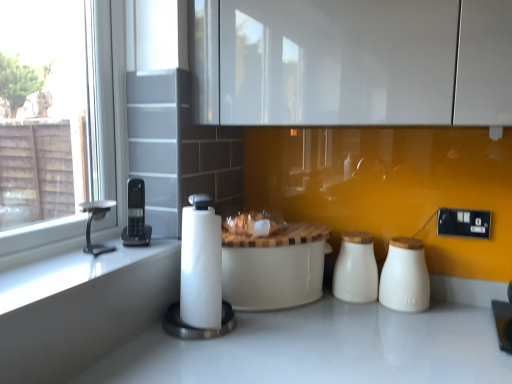
Question: Considering the relative sizes of white ceramic salt shaker at right, arranged as the 2th salt shaker when viewed from the left, and translucent plastic bag at center in the image provided, is white ceramic salt shaker at right, arranged as the 2th salt shaker when viewed from the left, thinner than translucent plastic bag at center?

Choices:
 (A) no
 (B) yes

Answer: (B)

Question: Is there a large distance between white ceramic salt shaker at right, arranged as the 2th salt shaker when viewed from the left, and translucent plastic bag at center?

Choices:
 (A) no
 (B) yes

Answer: (A)

Question: From the image's perspective, is white ceramic salt shaker at right, arranged as the 2th salt shaker when viewed from the left, above translucent plastic bag at center?

Choices:
 (A) yes
 (B) no

Answer: (B)

Question: Is white ceramic salt shaker at right, arranged as the 2th salt shaker when viewed from the left, positioned beyond the bounds of translucent plastic bag at center?

Choices:
 (A) no
 (B) yes

Answer: (B)

Question: From a real-world perspective, is white ceramic salt shaker at right, arranged as the 2th salt shaker when viewed from the left, physically above translucent plastic bag at center?

Choices:
 (A) yes
 (B) no

Answer: (B)

Question: Is white ceramic salt shaker at right, which appears as the first salt shaker when viewed from the right, taller than translucent plastic bag at center?

Choices:
 (A) no
 (B) yes

Answer: (B)

Question: From a real-world perspective, is white ceramic salt shaker at right, which appears as the first salt shaker when viewed from the right, below white ceramic table at center?

Choices:
 (A) yes
 (B) no

Answer: (B)

Question: Does white ceramic salt shaker at right, arranged as the 2th salt shaker when viewed from the left, have a lesser width compared to white ceramic table at center?

Choices:
 (A) no
 (B) yes

Answer: (B)

Question: From the image's perspective, would you say white ceramic salt shaker at right, arranged as the 2th salt shaker when viewed from the left, is positioned over white ceramic table at center?

Choices:
 (A) yes
 (B) no

Answer: (A)

Question: From a real-world perspective, is white ceramic salt shaker at right, arranged as the 2th salt shaker when viewed from the left, located higher than white ceramic table at center?

Choices:
 (A) no
 (B) yes

Answer: (B)

Question: Can you confirm if white ceramic salt shaker at right, arranged as the 2th salt shaker when viewed from the left, is positioned to the right of white ceramic table at center?

Choices:
 (A) yes
 (B) no

Answer: (A)

Question: Does white ceramic salt shaker at right, which appears as the first salt shaker when viewed from the right, lie behind white ceramic table at center?

Choices:
 (A) yes
 (B) no

Answer: (A)

Question: Is black plastic phone at left, which is the 2th appliance from right to left, shorter than white paper towel at center, the first appliance viewed from the right?

Choices:
 (A) yes
 (B) no

Answer: (A)